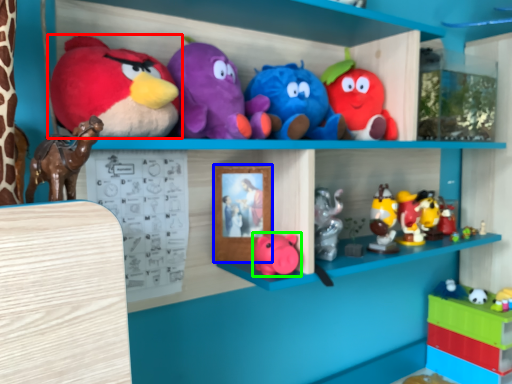
Question: Based on their relative distances, which object is nearer to toy (highlighted by a red box)? Choose from picture frame (highlighted by a blue box) and toy (highlighted by a green box).

Choices:
 (A) picture frame
 (B) toy

Answer: (A)